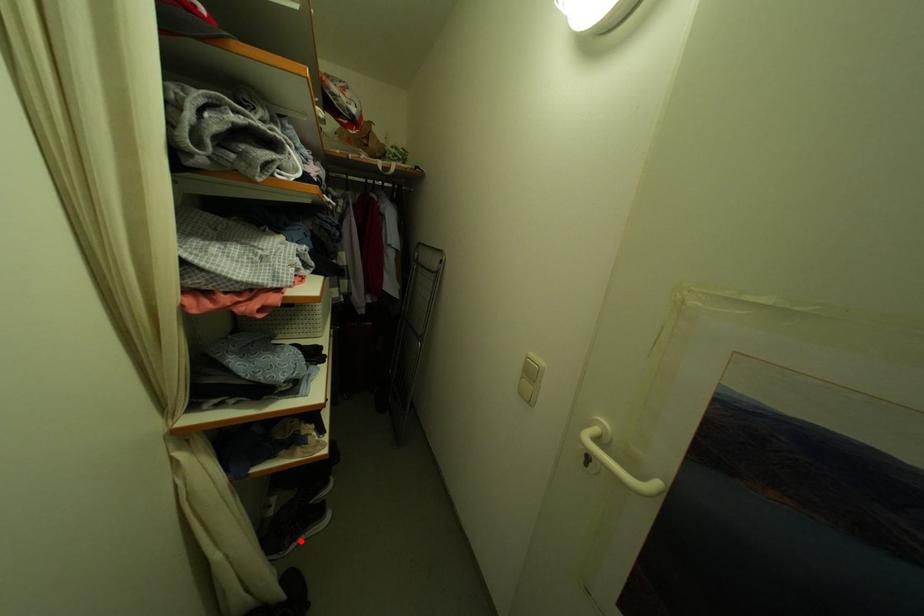
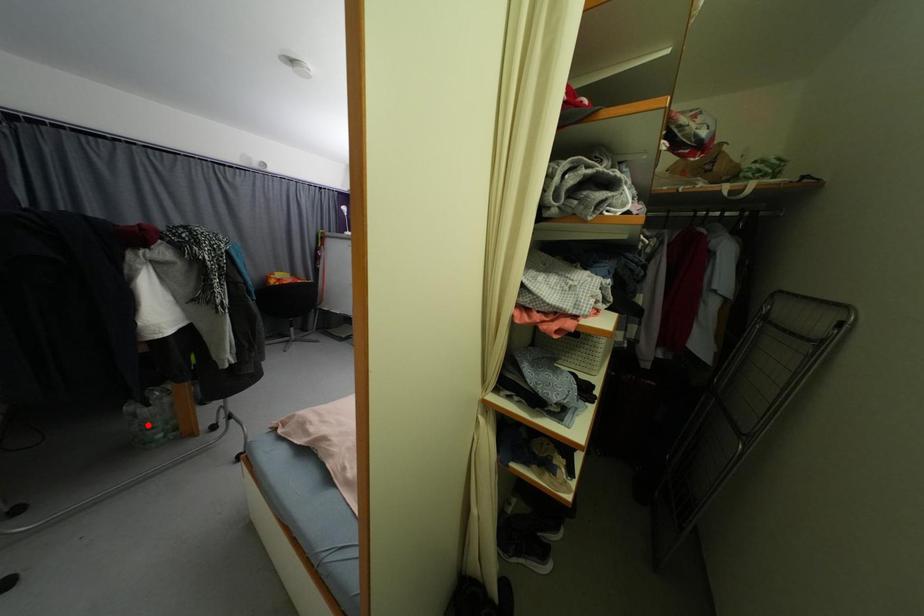
I am providing you with two images of the same scene from different viewpoints. A red point is marked on the first image and another point is marked on the second image. Is the marked point in image1 the same physical position as the marked point in image2?

No